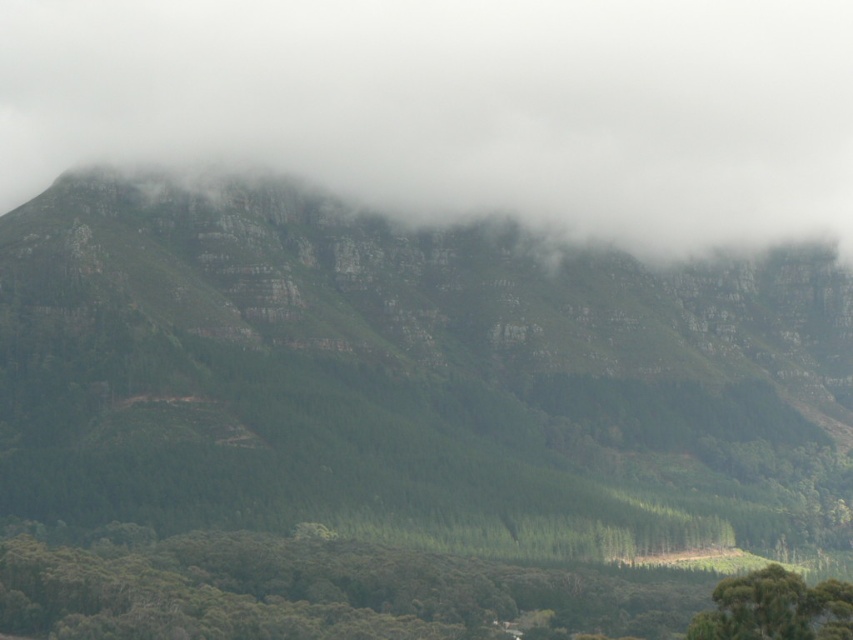
Looking at this image, does green textured mountain at center appear on the left side of green matte forest at lower center?

Yes, green textured mountain at center is to the left of green matte forest at lower center.

Is green textured mountain at center in front of green matte forest at lower center?

That is False.

Where is `green textured mountain at center`? This screenshot has width=853, height=640. green textured mountain at center is located at coordinates (407, 376).

Consider the image. Is green textured mountain at center above green leafy tree at lower right?

Yes.

Who is more distant from viewer, (524, 509) or (764, 614)?

Positioned behind is point (524, 509).

At what (x,y) coordinates should I click in order to perform the action: click on green textured mountain at center. Please return your answer as a coordinate pair (x, y). Image resolution: width=853 pixels, height=640 pixels. Looking at the image, I should click on (407, 376).

Does white fluffy cloud at upper center have a smaller size compared to green matte forest at lower center?

Actually, white fluffy cloud at upper center might be larger than green matte forest at lower center.

Identify the location of white fluffy cloud at upper center. Image resolution: width=853 pixels, height=640 pixels. click(459, 106).